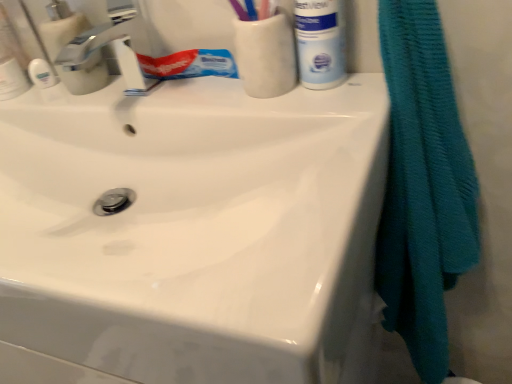
At what (x,y) coordinates should I click in order to perform the action: click on free location to the left of white matte mouthwash at upper right. Please return your answer as a coordinate pair (x, y). This screenshot has width=512, height=384. Looking at the image, I should click on (216, 102).